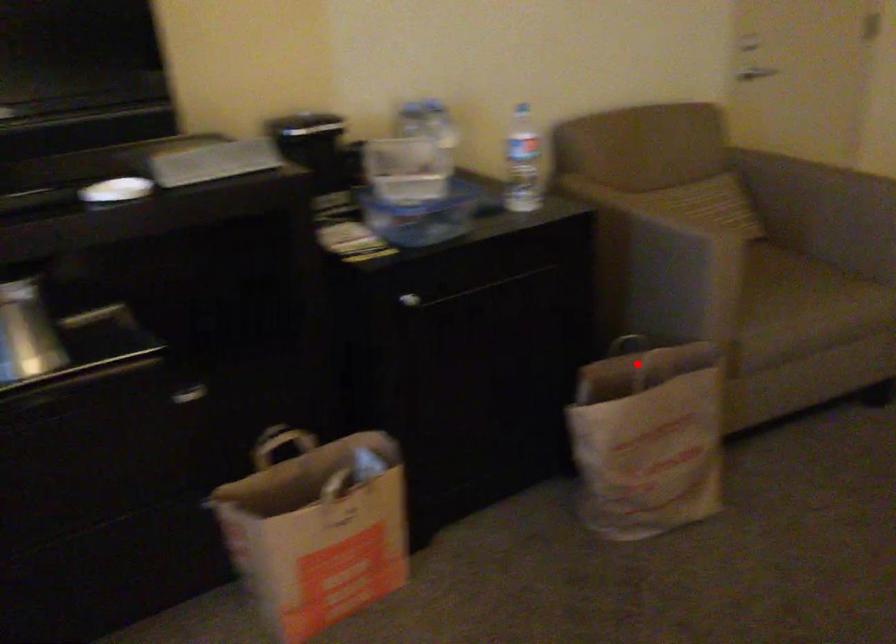
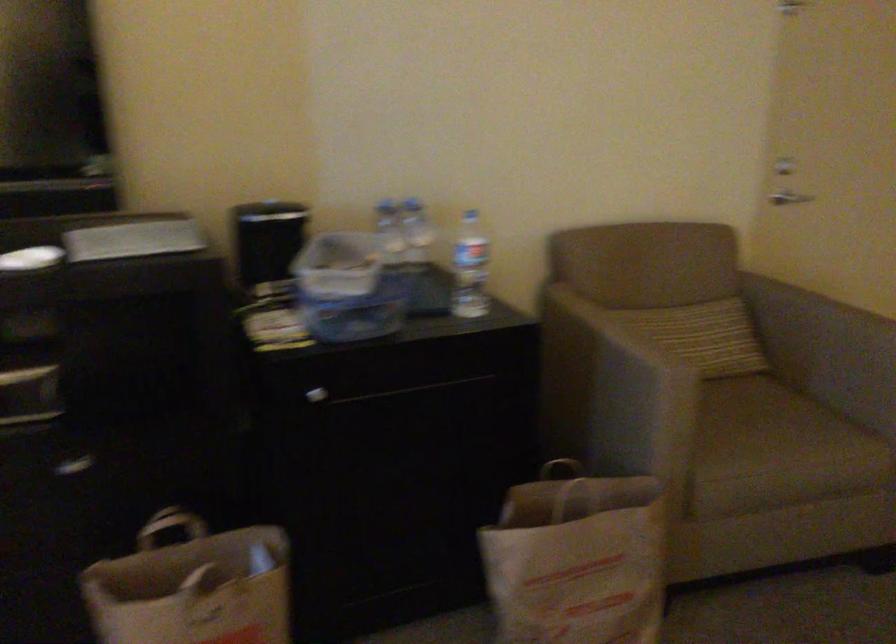
Find the pixel in the second image that matches the highlighted location in the first image.

(576, 493)